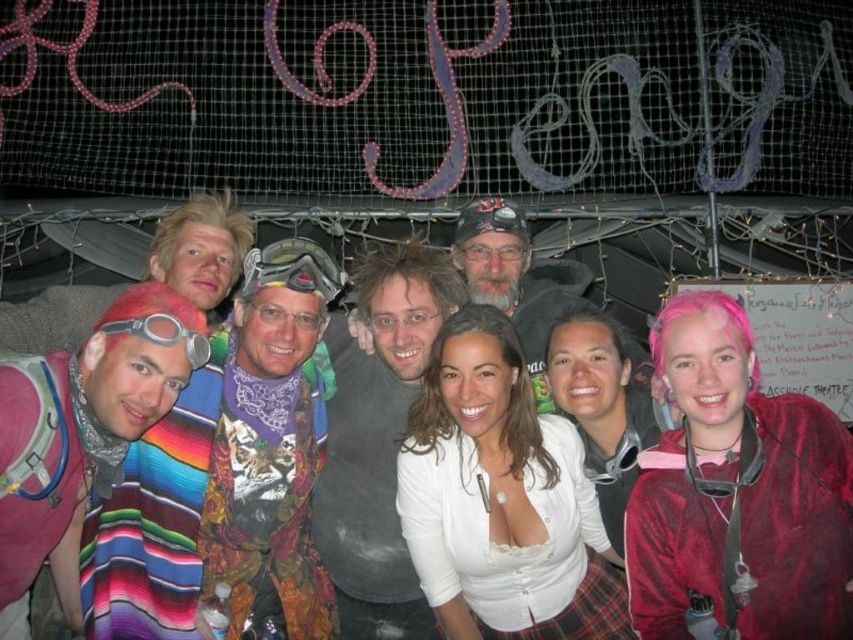
You are organizing a photo shoot and need to ensure that the multicolored woven blanket at center and the silver metallic goggles at left are visible in the final image. Based on their positions, which object is closer to the camera?

The multicolored woven blanket at center is positioned on the left side of the silver metallic goggles at left, meaning it is closer to the camera than the goggles.

You are organizing a photo shoot and need to ensure that the multicolored woven blanket at center and the silver metallic goggles at left are both visible in the frame. Based on their sizes, which object should you prioritize positioning closer to the camera to maintain clarity?

The multicolored woven blanket at center is wider than the silver metallic goggles at left, so you should prioritize positioning the multicolored woven blanket at center closer to the camera to maintain clarity.